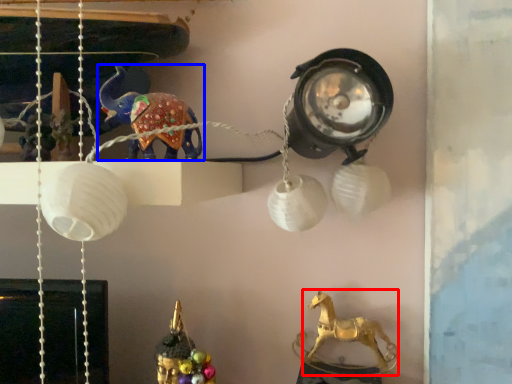
Question: Which object is closer to the camera taking this photo, animal (highlighted by a red box) or animal (highlighted by a blue box)?

Choices:
 (A) animal
 (B) animal

Answer: (B)